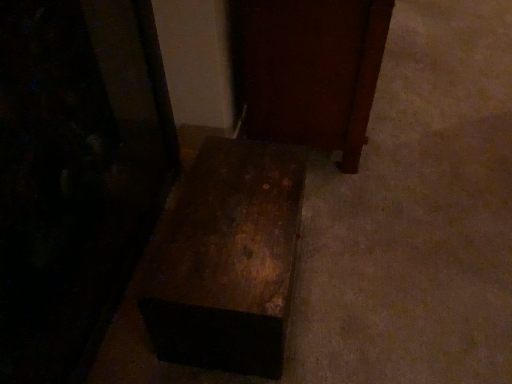
Question: Is rusty metal box at lower center, the 1th furniture from the left, in contact with dark wood door at center, marked as the 1th furniture in a right-to-left arrangement?

Choices:
 (A) no
 (B) yes

Answer: (A)

Question: From the image's perspective, is rusty metal box at lower center, the 1th furniture from the left, located beneath dark wood door at center, which appears as the 3th furniture when viewed from the left?

Choices:
 (A) yes
 (B) no

Answer: (A)

Question: Does rusty metal box at lower center, the 1th furniture from the left, contain dark wood door at center, marked as the 1th furniture in a right-to-left arrangement?

Choices:
 (A) no
 (B) yes

Answer: (A)

Question: Is rusty metal box at lower center, the third furniture in the right-to-left sequence, behind dark wood door at center, which appears as the 3th furniture when viewed from the left?

Choices:
 (A) yes
 (B) no

Answer: (B)

Question: Is rusty metal box at lower center, the third furniture in the right-to-left sequence, taller than dark wood door at center, which appears as the 3th furniture when viewed from the left?

Choices:
 (A) yes
 (B) no

Answer: (A)

Question: From their relative heights in the image, would you say rusty metal box at lower center, the third furniture in the right-to-left sequence, is taller or shorter than dark wood door at center, which appears as the 3th furniture when viewed from the left?

Choices:
 (A) short
 (B) tall

Answer: (B)

Question: In the image, is rusty metal box at lower center, the 1th furniture from the left, on the left side or the right side of dark wood door at center, which appears as the 3th furniture when viewed from the left?

Choices:
 (A) right
 (B) left

Answer: (B)

Question: From the image's perspective, is rusty metal box at lower center, the 1th furniture from the left, located above or below dark wood door at center, marked as the 1th furniture in a right-to-left arrangement?

Choices:
 (A) above
 (B) below

Answer: (B)

Question: Is rusty metal box at lower center, the 1th furniture from the left, wider or thinner than dark wood door at center, which appears as the 3th furniture when viewed from the left?

Choices:
 (A) wide
 (B) thin

Answer: (B)

Question: From a real-world perspective, relative to dark wood door at center, marked as the 1th furniture in a right-to-left arrangement, is rusty wood trunk at center, arranged as the second furniture when viewed from the right, vertically above or below?

Choices:
 (A) below
 (B) above

Answer: (A)

Question: Considering the positions of rusty wood trunk at center, placed as the second furniture when sorted from left to right, and dark wood door at center, which appears as the 3th furniture when viewed from the left, in the image, is rusty wood trunk at center, placed as the second furniture when sorted from left to right, wider or thinner than dark wood door at center, which appears as the 3th furniture when viewed from the left,?

Choices:
 (A) wide
 (B) thin

Answer: (B)

Question: In the image, is rusty wood trunk at center, arranged as the second furniture when viewed from the right, positioned in front of or behind dark wood door at center, marked as the 1th furniture in a right-to-left arrangement?

Choices:
 (A) front
 (B) behind

Answer: (A)

Question: Does point (206, 172) appear closer or farther from the camera than point (304, 76)?

Choices:
 (A) farther
 (B) closer

Answer: (B)

Question: From a real-world perspective, relative to rusty metal box at lower center, the third furniture in the right-to-left sequence, is rusty wood trunk at center, placed as the second furniture when sorted from left to right, vertically above or below?

Choices:
 (A) above
 (B) below

Answer: (B)

Question: Considering the positions of rusty wood trunk at center, arranged as the second furniture when viewed from the right, and rusty metal box at lower center, the third furniture in the right-to-left sequence, in the image, is rusty wood trunk at center, arranged as the second furniture when viewed from the right, wider or thinner than rusty metal box at lower center, the third furniture in the right-to-left sequence,?

Choices:
 (A) wide
 (B) thin

Answer: (A)